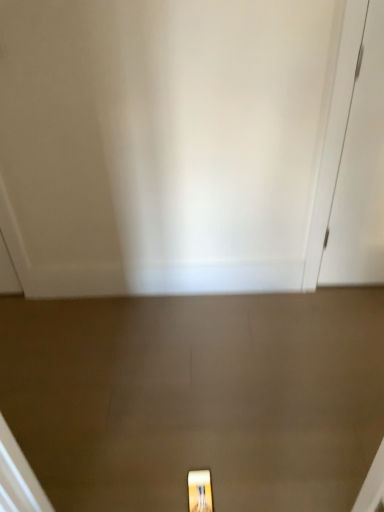
Question: Considering the relative sizes of white matte door at right, which is counted as the second door, starting from the front, and white glossy door at center, which ranks as the 2th door in back-to-front order, in the image provided, is white matte door at right, which is counted as the second door, starting from the front, shorter than white glossy door at center, which ranks as the 2th door in back-to-front order,?

Choices:
 (A) yes
 (B) no

Answer: (A)

Question: From the image's perspective, is white matte door at right, which is counted as the second door, starting from the front, on top of white glossy door at center, which is the 1th door from front to back?

Choices:
 (A) no
 (B) yes

Answer: (B)

Question: From a real-world perspective, is white matte door at right, which is the first door in right-to-left order, physically above white glossy door at center, which is the 1th door from front to back?

Choices:
 (A) no
 (B) yes

Answer: (A)

Question: Is white matte door at right, placed as the 1th door when sorted from back to front, aimed at white glossy door at center, acting as the 2th door starting from the right?

Choices:
 (A) no
 (B) yes

Answer: (A)

Question: Does white matte door at right, which is the first door in right-to-left order, appear on the left side of white glossy door at center, acting as the 2th door starting from the right?

Choices:
 (A) yes
 (B) no

Answer: (B)

Question: Is white matte door at right, marked as the second door in a left-to-right arrangement, positioned behind white glossy door at center, which ranks as the 2th door in back-to-front order?

Choices:
 (A) yes
 (B) no

Answer: (A)

Question: Considering the relative sizes of white glossy door at center, which is the 1th door from front to back, and white matte door at right, which is the first door in right-to-left order, in the image provided, is white glossy door at center, which is the 1th door from front to back, thinner than white matte door at right, which is the first door in right-to-left order,?

Choices:
 (A) no
 (B) yes

Answer: (A)

Question: Is white glossy door at center, acting as the 2th door starting from the right, positioned in front of white matte door at right, which is counted as the second door, starting from the front?

Choices:
 (A) yes
 (B) no

Answer: (A)

Question: Is white glossy door at center, acting as the 2th door starting from the right, further to the viewer compared to white matte door at right, which is the first door in right-to-left order?

Choices:
 (A) yes
 (B) no

Answer: (B)

Question: From the image's perspective, is white glossy door at center, acting as the 2th door starting from the right, located beneath white matte door at right, which is counted as the second door, starting from the front?

Choices:
 (A) no
 (B) yes

Answer: (B)

Question: Would you say white glossy door at center, acting as the 2th door starting from the right, is outside white matte door at right, which is the first door in right-to-left order?

Choices:
 (A) yes
 (B) no

Answer: (A)

Question: Can you see white glossy door at center, which is the 1th door from front to back, touching white matte door at right, placed as the 1th door when sorted from back to front?

Choices:
 (A) no
 (B) yes

Answer: (A)

Question: Is matte gold light fixture at lower center completely or partially outside of white glossy door at center, which is the 1th door from left to right?

Choices:
 (A) no
 (B) yes

Answer: (B)